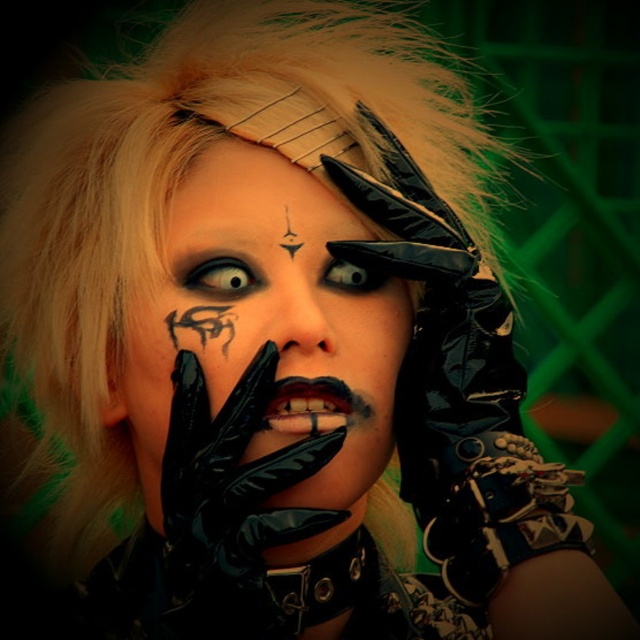
Which of these two, smokey gray eye at center or black matte eye at center, stands taller?

With more height is smokey gray eye at center.

Does smokey gray eye at center have a smaller size compared to black matte eye at center?

Correct, smokey gray eye at center occupies less space than black matte eye at center.

Is point (218, 256) farther from viewer compared to point (384, 275)?

No, (218, 256) is in front of (384, 275).

Identify the location of smokey gray eye at center. (221, 276).

Based on the photo, between matte black face at center and smokey gray eye at center, which one has less height?

With less height is smokey gray eye at center.

Is matte black face at center below smokey gray eye at center?

Indeed, matte black face at center is positioned under smokey gray eye at center.

Is point (129, 320) farther from viewer compared to point (236, 296)?

That is True.

Find the location of a particular element. The image size is (640, 640). matte black face at center is located at coordinates (269, 323).

Is black glossy glove at center positioned before black matte eye at center?

Yes, it is in front of black matte eye at center.

Who is positioned more to the left, black glossy glove at center or black matte eye at center?

From the viewer's perspective, black glossy glove at center appears more on the left side.

At what (x,y) coordinates should I click in order to perform the action: click on black glossy glove at center. Please return your answer as a coordinate pair (x, y). This screenshot has width=640, height=640. Looking at the image, I should click on (232, 477).